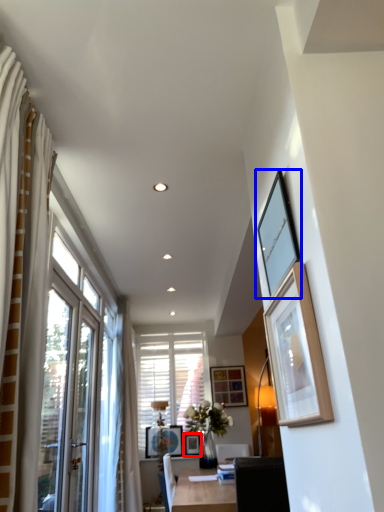
Question: Among these objects, which one is farthest to the camera, picture frame (highlighted by a red box) or picture frame (highlighted by a blue box)?

Choices:
 (A) picture frame
 (B) picture frame

Answer: (A)